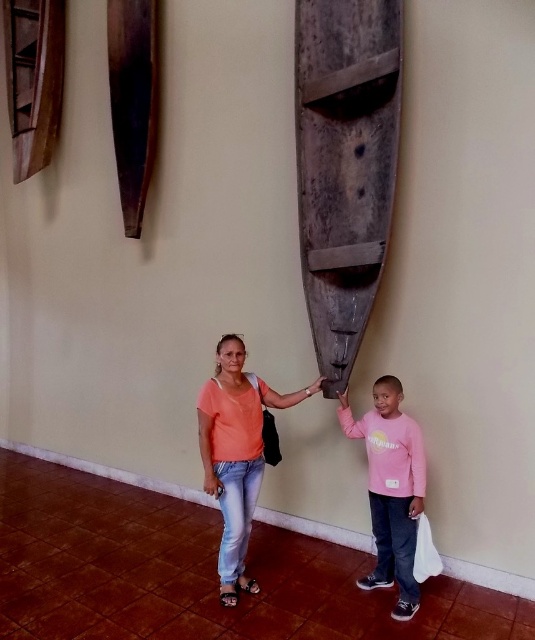
Question: Which object appears closest to the camera in this image?

Choices:
 (A) dark brown wood boat at center
 (B) matte orange shirt at center
 (C) pink cotton shirt at center

Answer: (C)

Question: Can you confirm if dark brown wood boat at center is bigger than matte orange shirt at center?

Choices:
 (A) yes
 (B) no

Answer: (A)

Question: Does matte orange shirt at center appear on the right side of pink cotton shirt at center?

Choices:
 (A) no
 (B) yes

Answer: (A)

Question: Can you confirm if dark brown wood boat at center is positioned to the right of matte orange shirt at center?

Choices:
 (A) no
 (B) yes

Answer: (B)

Question: Estimate the real-world distances between objects in this image. Which object is closer to the dark brown wood boat at center?

Choices:
 (A) pink cotton shirt at center
 (B) matte orange shirt at center

Answer: (B)

Question: Which object appears farthest from the camera in this image?

Choices:
 (A) matte orange shirt at center
 (B) pink cotton shirt at center
 (C) dark brown wood boat at center

Answer: (A)